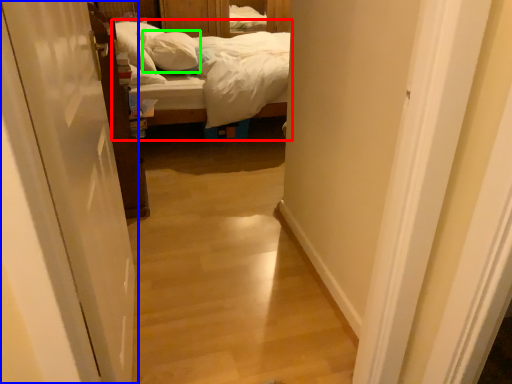
Question: Which object is the farthest from bed (highlighted by a red box)? Choose among these: door (highlighted by a blue box) or pillow (highlighted by a green box).

Choices:
 (A) door
 (B) pillow

Answer: (A)